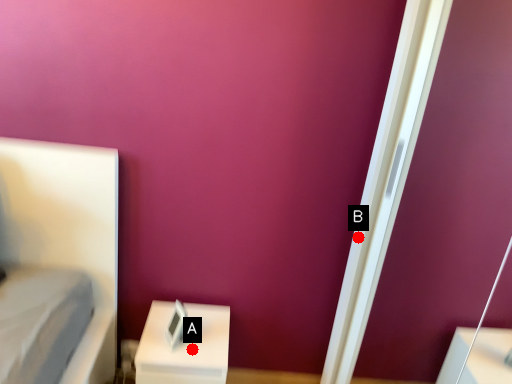
Question: Two points are circled on the image, labeled by A and B beside each circle. Which point appears farthest from the camera in this image?

Choices:
 (A) A is further
 (B) B is further

Answer: (B)